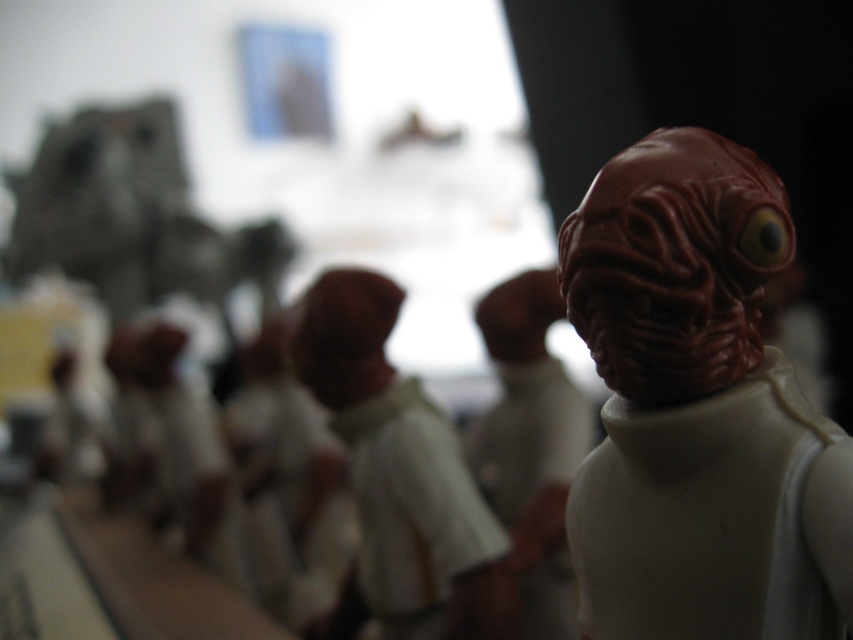
Based on the photo, you are a toy collector who wants to place a new figure exactly at the center of your display shelf. The display shelf has a coordinate system where the bottom left corner is the origin point. The shelf is 1 meter wide and 1 meter tall. You have a white matte figure at center from the image. Can you determine if the figure is already positioned at the center of the shelf?

The white matte figure at center is positioned at point [398,472], which is not exactly the center of the shelf. The center would be at coordinates [426,320]. Therefore, the figure is not centered.

You are trying to place both the white matte figure at center and the matte white figure at center on a shelf that can only hold one of them. Which one should you choose based on their width?

The white matte figure at center is wider than the matte white figure at center, so you should choose the white matte figure at center to place on the shelf.